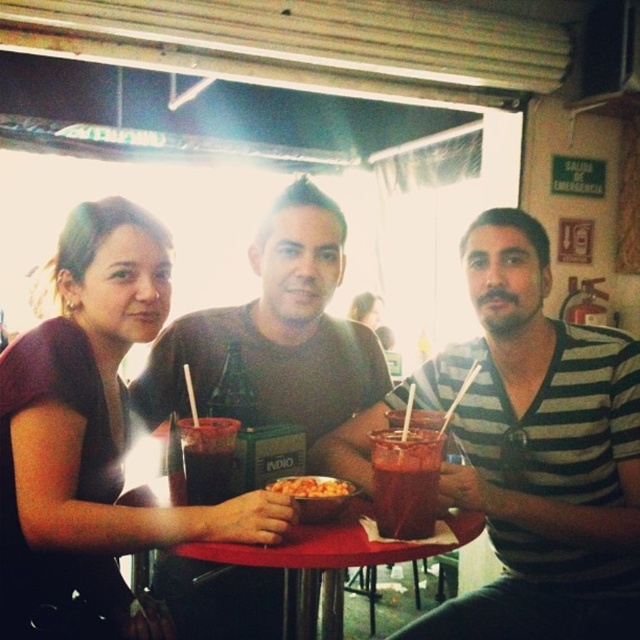
Does point (536, 456) come closer to viewer compared to point (145, 300)?

No.

Find the location of a particular element. The width and height of the screenshot is (640, 640). striped cotton shirt at center is located at coordinates (x=529, y=451).

Between point (368, 465) and point (125, 264), which one is positioned in front?

Point (125, 264) is more forward.

Find the location of a particular element. striped cotton shirt at center is located at coordinates (529, 451).

In the scene shown: Which is more to the left, striped cotton shirt at center or dark red glass at center?

Positioned to the left is dark red glass at center.

Based on the photo, is striped cotton shirt at center shorter than dark red glass at center?

In fact, striped cotton shirt at center may be taller than dark red glass at center.

Between point (484, 636) and point (192, 435), which one is positioned behind?

Positioned behind is point (484, 636).

The width and height of the screenshot is (640, 640). Find the location of `striped cotton shirt at center`. striped cotton shirt at center is located at coordinates (529, 451).

From the picture: Is striped cotton shirt at center behind shiny plastic bowl of pasta at center?

Yes, striped cotton shirt at center is further from the viewer.

Can you confirm if striped cotton shirt at center is wider than shiny plastic bowl of pasta at center?

Indeed, striped cotton shirt at center has a greater width compared to shiny plastic bowl of pasta at center.

Who is more distant from viewer, [497,232] or [316,481]?

Positioned behind is point [497,232].

What are the coordinates of `striped cotton shirt at center` in the screenshot? It's located at (529, 451).